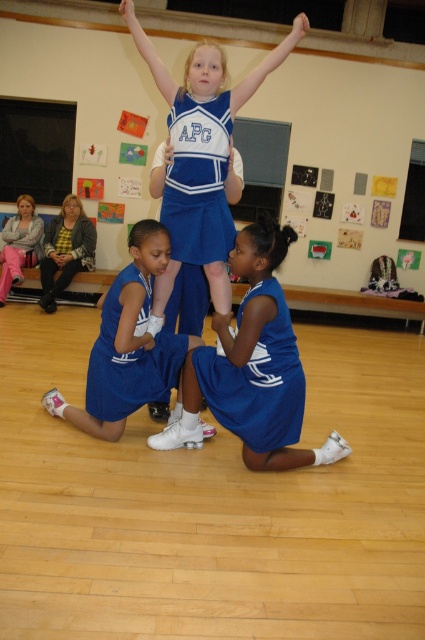
You are a gymnastics coach observing the cheerleading team. You notice two specific points marked in the image. The first point is at coordinates point (127,314) and the second is at point (175,154). From your vantage point, which point is closer to you?

Point (127,314) is in front of point (175,154), so it is closer to you.

Based on the scene described, which object is positioned to the right when comparing the blue fabric cheerleader at center and the matte blue uniform at lower left?

The blue fabric cheerleader at center is positioned to the right of the matte blue uniform at lower left.

You are a photographer in the gymnasium and need to capture a clear photo of both the blue fabric uniform at center and the blue jersey at center. Which object should you focus on first if you want to ensure the taller one is in focus?

The blue fabric uniform at center is taller than the blue jersey at center, so you should focus on the blue fabric uniform at center first to ensure it is in focus.